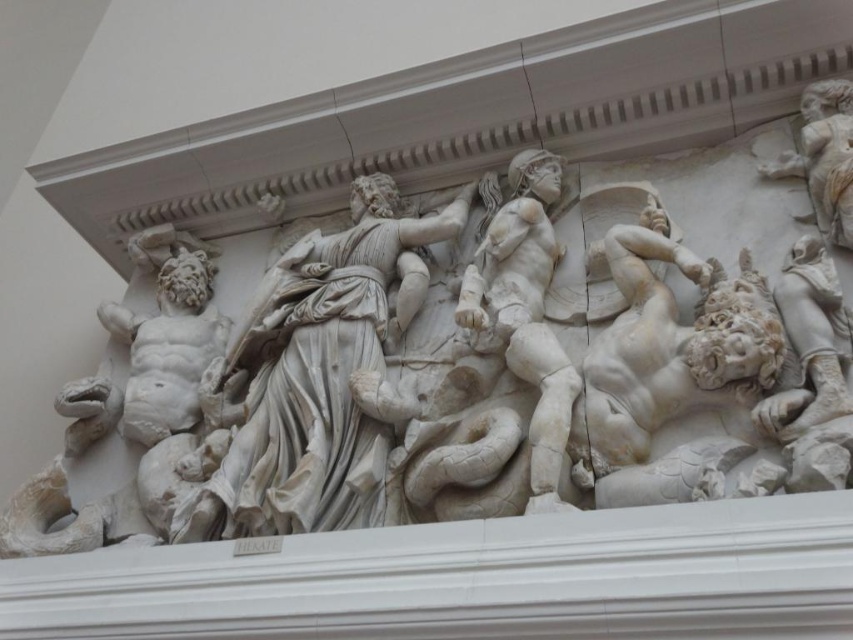
You are an archaeologist examining the marble relief sculpture. You notice two points marked on the image at coordinates point (33, 506) and point (729, 460). Which point is closer to the front of the sculpture?

Point (729, 460) is closer to the front of the sculpture because it is in front of point (33, 506).

You are an art conservator assessing the spatial arrangement of the classical marble relief sculpture. Given that the white marble sculpture at center and the white marble warrior at upper right are part of the same artwork, which object occupies more horizontal space in the composition?

The white marble sculpture at center occupies more horizontal space than the white marble warrior at upper right because its width is larger, as stated in the description.

You are an art conservator examining the classical marble relief sculpture. You need to determine if the white marble sculpture at center can be placed on a display stand that is narrower than the white marble figure at right. Is this possible?

The white marble sculpture at center might be wider than the white marble figure at right, so it is uncertain if it will fit on the display stand. Further measurements are needed to confirm.